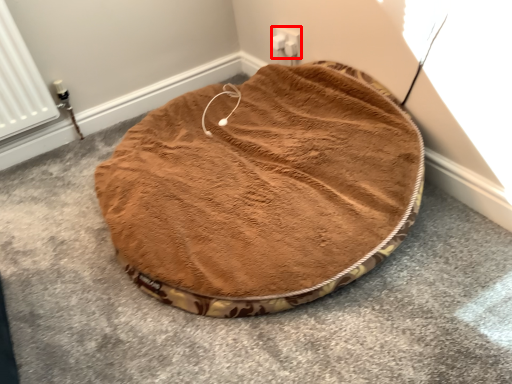
Question: Where is electric outlet (annotated by the red box) located in relation to dog bed in the image?

Choices:
 (A) left
 (B) right

Answer: (B)